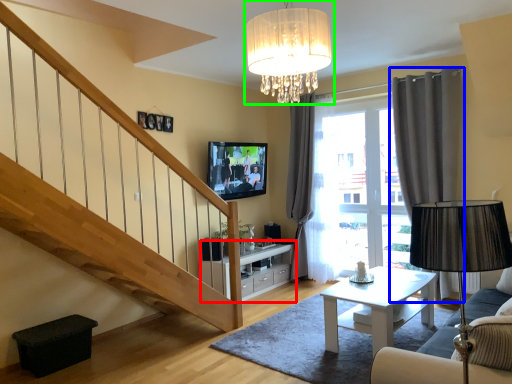
Question: Which object is positioned farthest from cabinetry (highlighted by a red box)? Select from curtain (highlighted by a blue box) and lamp (highlighted by a green box).

Choices:
 (A) curtain
 (B) lamp

Answer: (B)